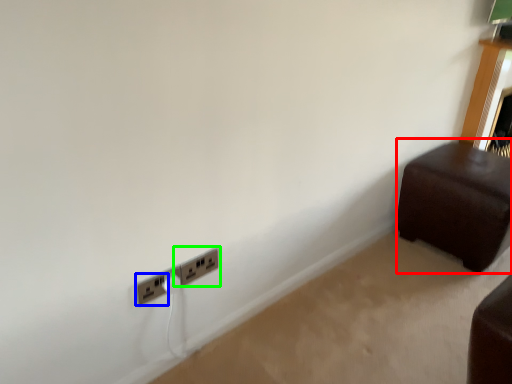
Question: Based on their relative distances, which object is farther from furniture (highlighted by a red box)? Choose from power plugs and sockets (highlighted by a blue box) and power plugs and sockets (highlighted by a green box).

Choices:
 (A) power plugs and sockets
 (B) power plugs and sockets

Answer: (A)